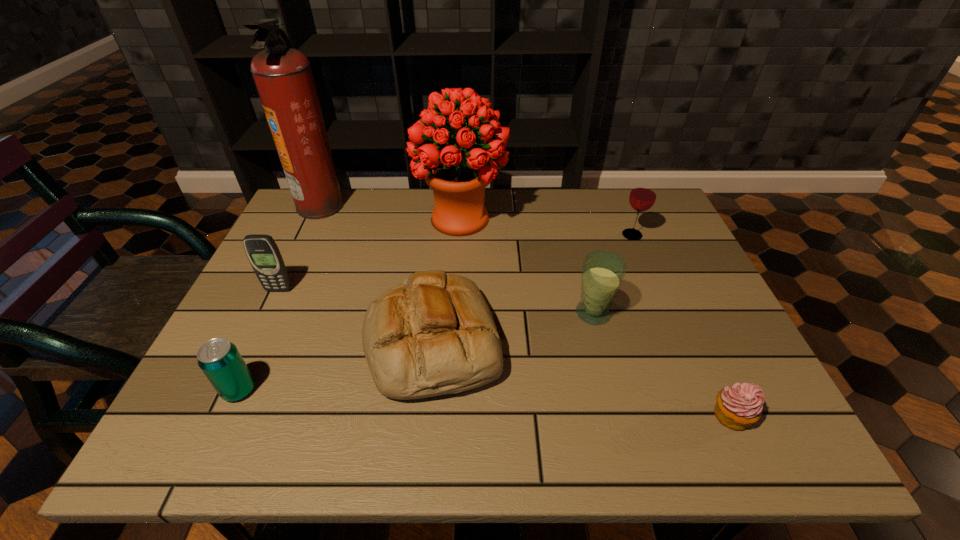
You are a GUI agent. You are given a task and a screenshot of the screen. Output one action in this format:
    pyautogui.click(x=<x>, y=<y>)
    Task: Click on the vacant space located on the right of the bouquet
    
    Given the screenshot: What is the action you would take?
    [610, 219]

Where is `vacant space situated 0.050m on the back of the farther glass`? vacant space situated 0.050m on the back of the farther glass is located at coordinates (625, 218).

Identify the location of vacant area situated on the screen of the cellular telephone. This screenshot has width=960, height=540. (223, 408).

At what (x,y) coordinates should I click in order to perform the action: click on vacant space located 0.400m on the left of the nearer glass. Please return your answer as a coordinate pair (x, y). This screenshot has height=540, width=960. Looking at the image, I should click on (405, 313).

The width and height of the screenshot is (960, 540). Identify the location of free space located 0.290m on the left of the bread. (233, 343).

Image resolution: width=960 pixels, height=540 pixels. In order to click on free space located 0.210m on the back of the beer can in this screenshot , I will do `click(279, 303)`.

The image size is (960, 540). I want to click on free location located 0.250m on the left of the cupcake, so click(582, 416).

Image resolution: width=960 pixels, height=540 pixels. I want to click on fire extinguisher that is at the far edge, so click(283, 77).

Locate an element on the screen. Image resolution: width=960 pixels, height=540 pixels. bouquet that is at the far edge is located at coordinates (458, 178).

This screenshot has height=540, width=960. I want to click on glass that is positioned at the far edge, so click(x=642, y=197).